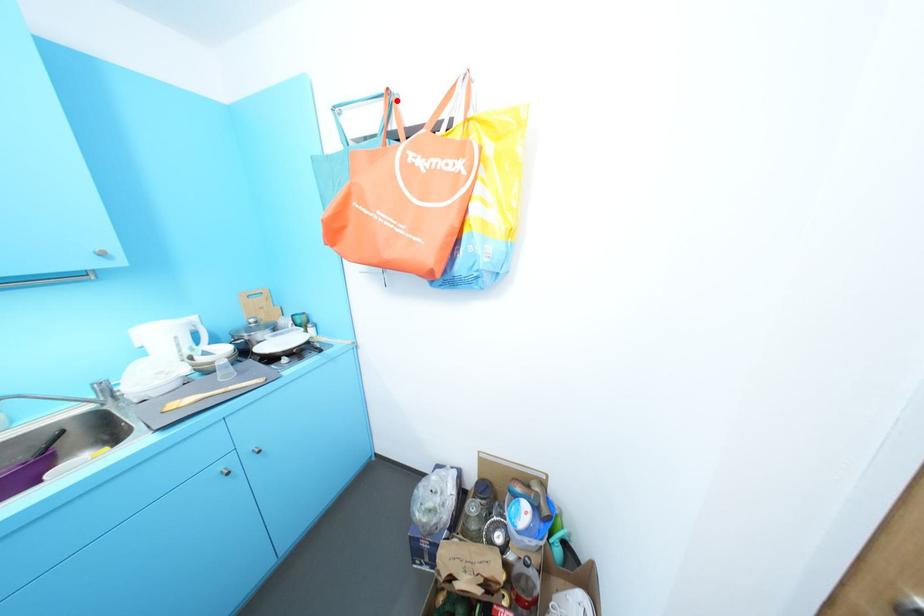
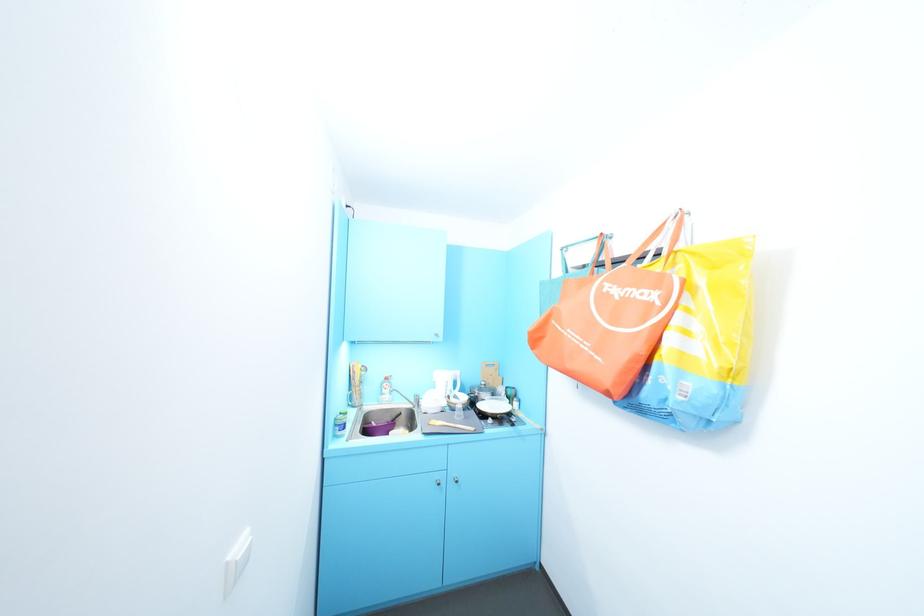
Locate, in the second image, the point that corresponds to the highlighted location in the first image.

(610, 241)